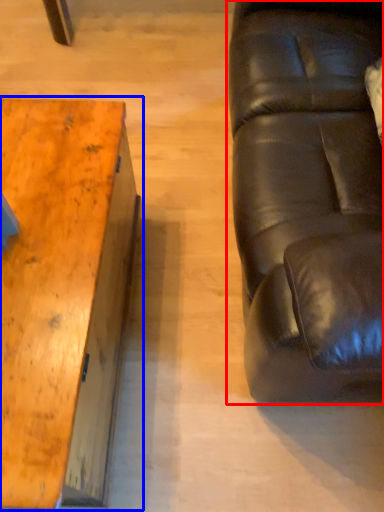
Question: Which object is further to the camera taking this photo, studio couch (highlighted by a red box) or table (highlighted by a blue box)?

Choices:
 (A) studio couch
 (B) table

Answer: (B)